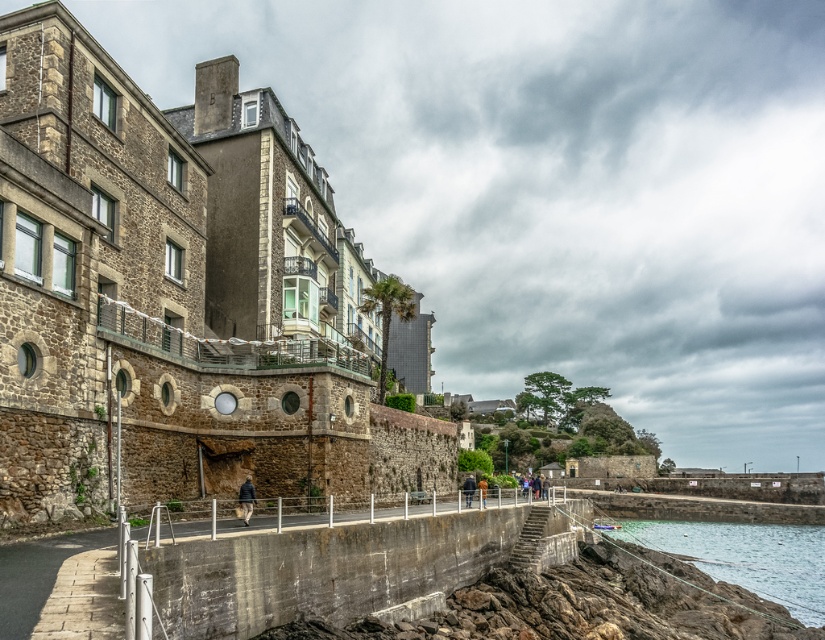
Question: In this image, where is clear water at lower right located relative to khaki fabric pants at lower center?

Choices:
 (A) below
 (B) above

Answer: (A)

Question: Estimate the real-world distances between objects in this image. Which object is closer to the clear water at lower right?

Choices:
 (A) blurred fabric jacket at center
 (B) brown leather jacket at center
 (C) khaki fabric pants at lower center

Answer: (A)

Question: Which is farther from the khaki fabric pants at lower center?

Choices:
 (A) clear water at lower right
 (B) brown leather jacket at center

Answer: (A)

Question: Can you confirm if brown leather jacket at center is smaller than blurred fabric jacket at center?

Choices:
 (A) yes
 (B) no

Answer: (B)

Question: Is the position of clear water at lower right less distant than that of khaki fabric pants at lower center?

Choices:
 (A) no
 (B) yes

Answer: (A)

Question: Which is farther from the clear water at lower right?

Choices:
 (A) khaki fabric pants at lower center
 (B) blurred fabric jacket at center

Answer: (A)